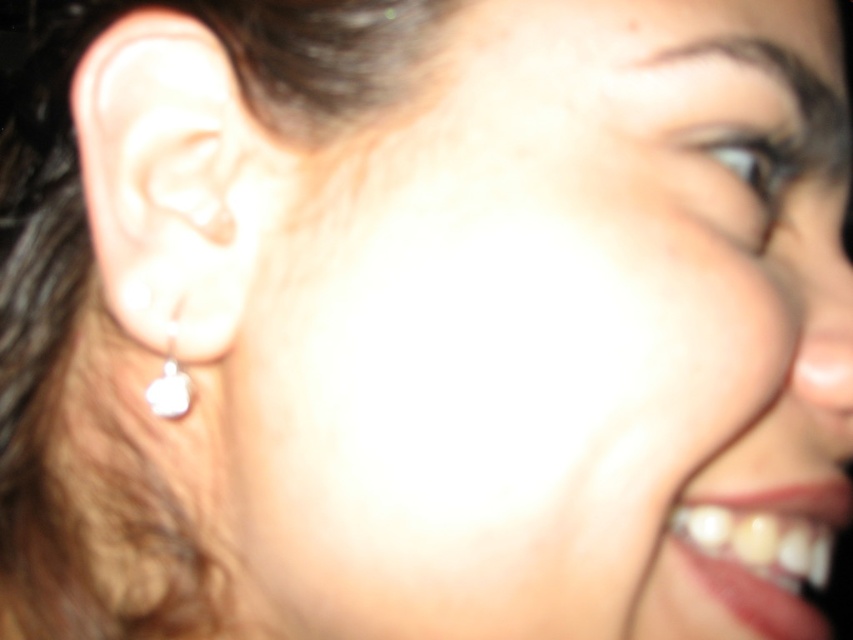
Between pearl earring at left and silver metallic earring at left, which one appears on the left side from the viewer's perspective?

pearl earring at left

Does pearl earring at left have a lesser width compared to silver metallic earring at left?

In fact, pearl earring at left might be wider than silver metallic earring at left.

Who is more forward, (276,182) or (155,406)?

Point (276,182)

Image resolution: width=853 pixels, height=640 pixels. I want to click on pearl earring at left, so click(172, 180).